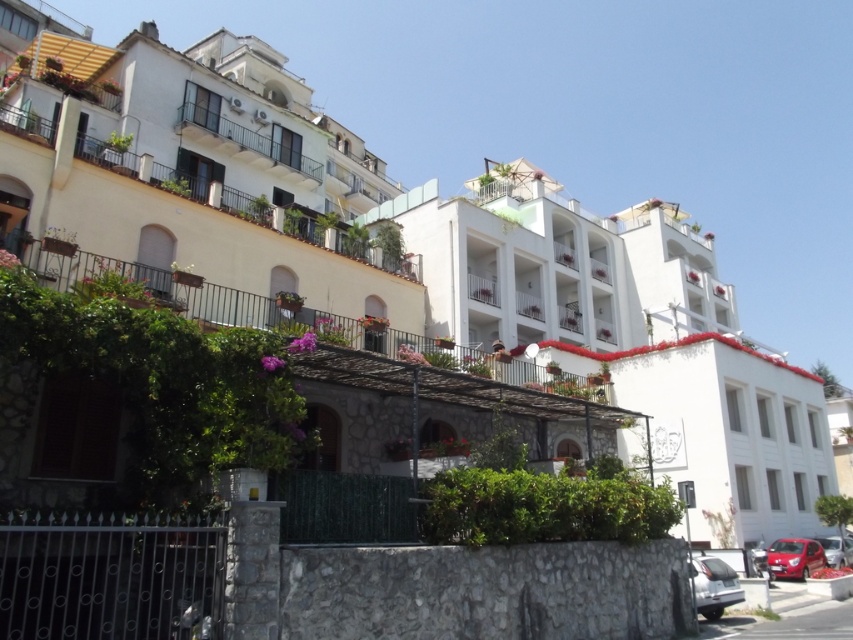
Question: Estimate the real-world distances between objects in this image. Which object is closer to the silver metallic car at lower right?

Choices:
 (A) white stone building at center
 (B) metallic balcony at upper center
 (C) shiny red car at lower right
 (D) metallic red car at lower right

Answer: (C)

Question: Where is metallic balcony at upper center located in relation to metallic red car at lower right in the image?

Choices:
 (A) below
 (B) above

Answer: (B)

Question: Is silver metallic car at lower right further to camera compared to shiny red car at lower right?

Choices:
 (A) yes
 (B) no

Answer: (B)

Question: Is metallic balcony at upper center above shiny red car at lower right?

Choices:
 (A) no
 (B) yes

Answer: (B)

Question: Which point is closer to the camera taking this photo?

Choices:
 (A) (735, 577)
 (B) (544, 257)
 (C) (824, 544)
 (D) (814, 564)

Answer: (A)

Question: Which point appears closest to the camera in this image?

Choices:
 (A) (715, 600)
 (B) (648, 369)
 (C) (195, 108)

Answer: (A)